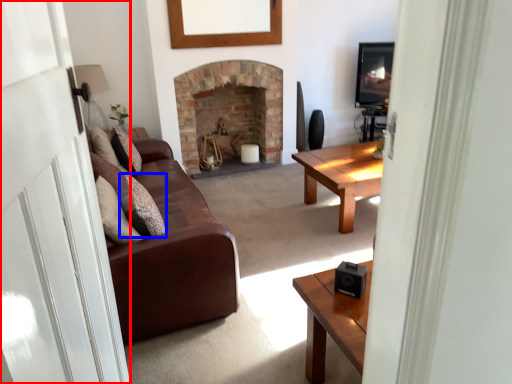
Question: Which object appears closest to the camera in this image, glass door (highlighted by a red box) or pillow (highlighted by a blue box)?

Choices:
 (A) glass door
 (B) pillow

Answer: (A)